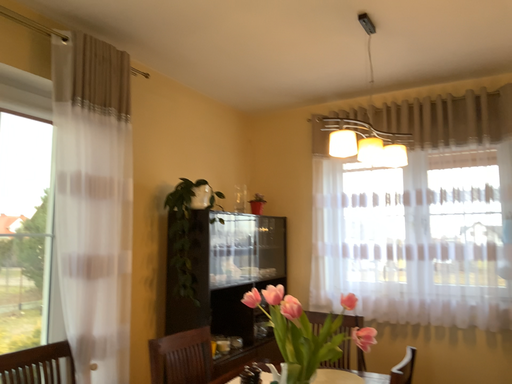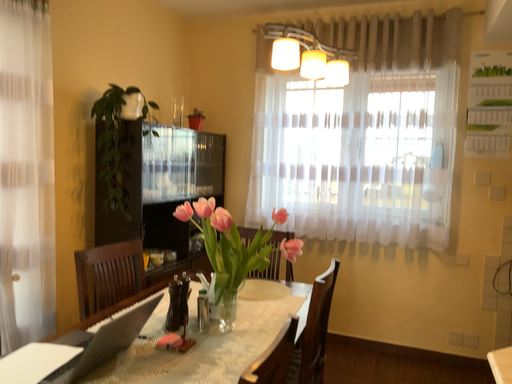
Question: Which way did the camera rotate in the video?

Choices:
 (A) rotated upward
 (B) rotated downward

Answer: (B)